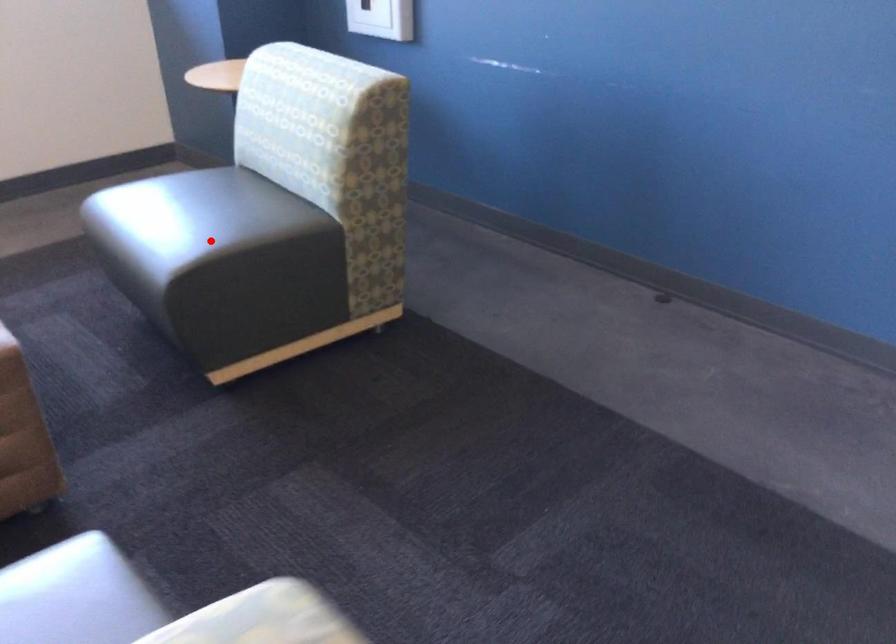
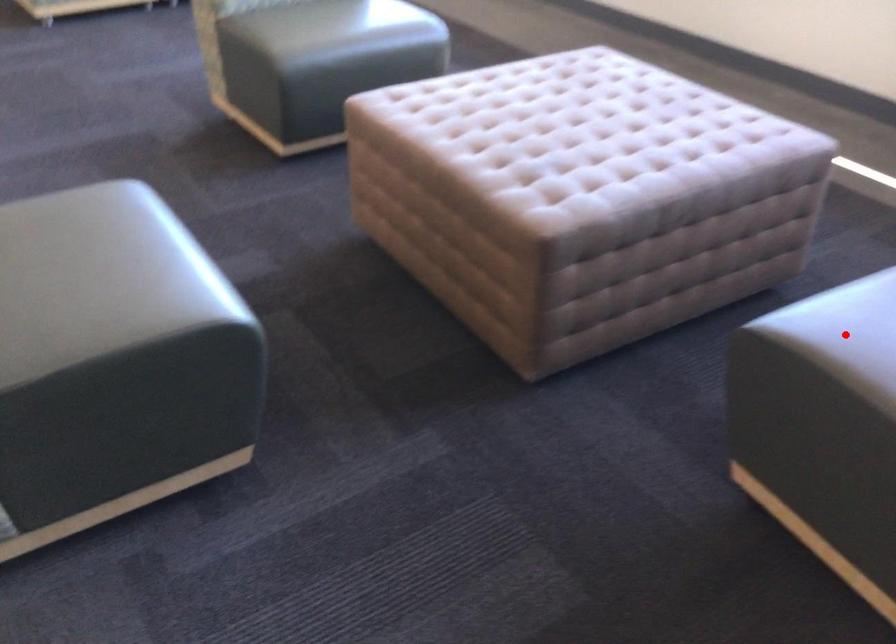
I am providing you with two images of the same scene from different viewpoints. A red point is marked on the first image and another point is marked on the second image. Are the points marked in image1 and image2 representing the same 3D position?

Yes